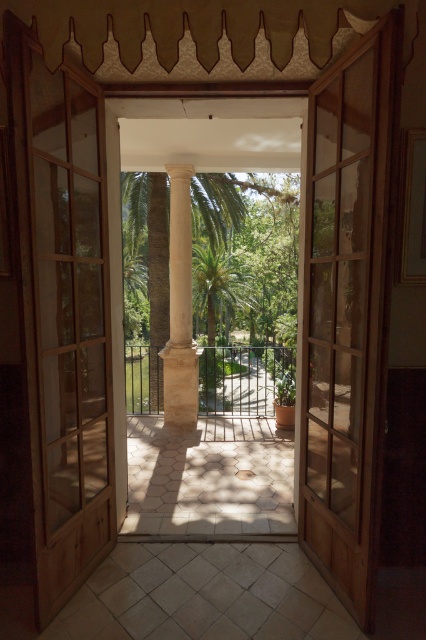
You are trying to exit through the door but need to know which one is closer to you. Which door should you approach first, the clear wood glass door at center or the wooden door at center?

You should approach the clear wood glass door at center first because it is closer to you than the wooden door at center.

Based on the photo, you are standing inside a room and want to exit through the wooden door at center. There is also a white stone column at center in your way. Can you walk straight towards the door without going around the column?

The wooden door at center is closer to the viewer than the white stone column at center, so the column is behind the door. Therefore, you can walk straight towards the wooden door at center without obstruction from the column.

You are carrying a large painting that is 1 meter wide and need to move it through the wooden door at center. Based on the door dimensions, can you fit the painting through the door without tilting it?

The wooden door at center has a width that can accommodate a 1 meter wide painting without tilting it, so yes, it can fit through the door.